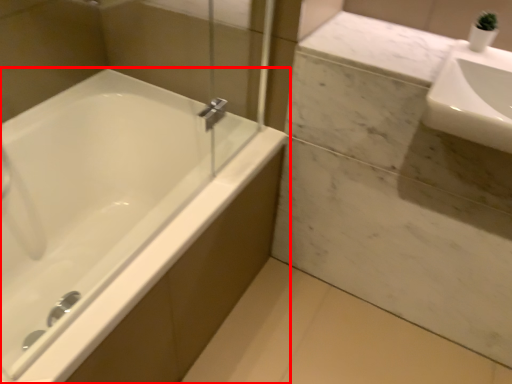
Question: In this image, where is bathtub (annotated by the red box) located relative to sink?

Choices:
 (A) right
 (B) left

Answer: (B)